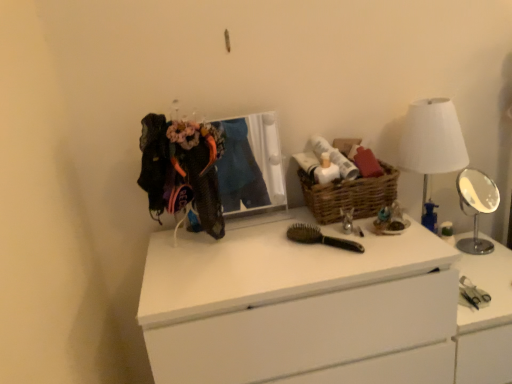
Find the location of a particular element. free location to the left of woven brown basket at center is located at coordinates (279, 229).